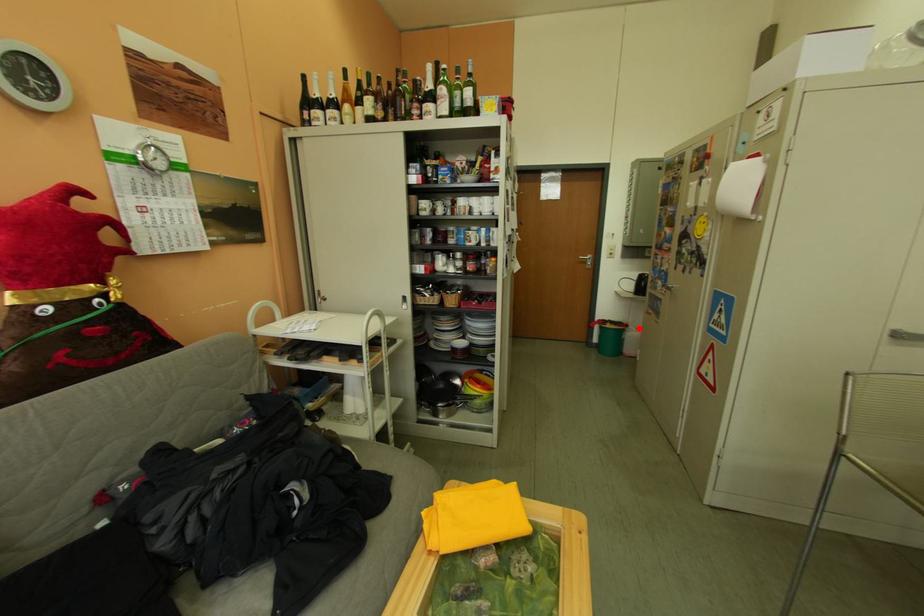
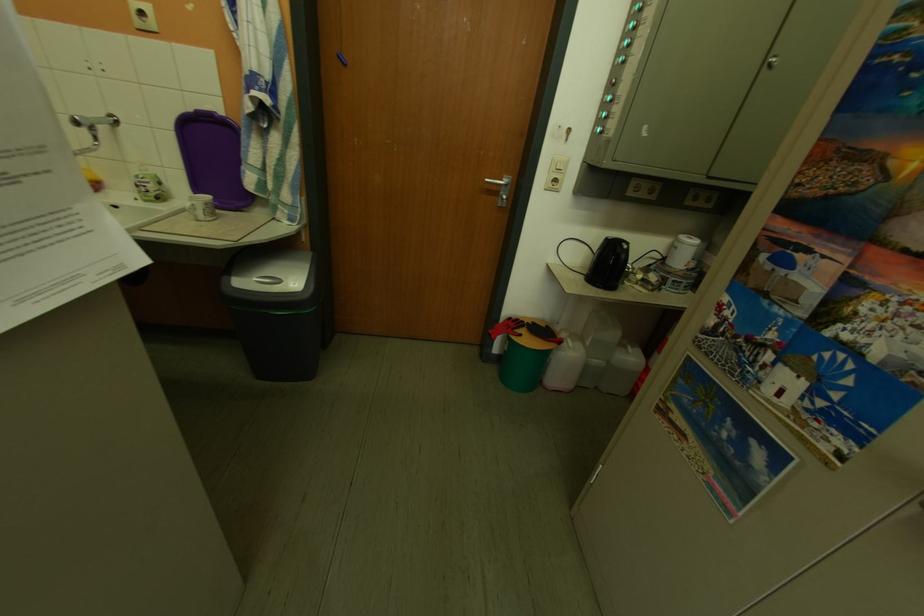
In the second image, find the point that corresponds to the highlighted location in the first image.

(574, 345)